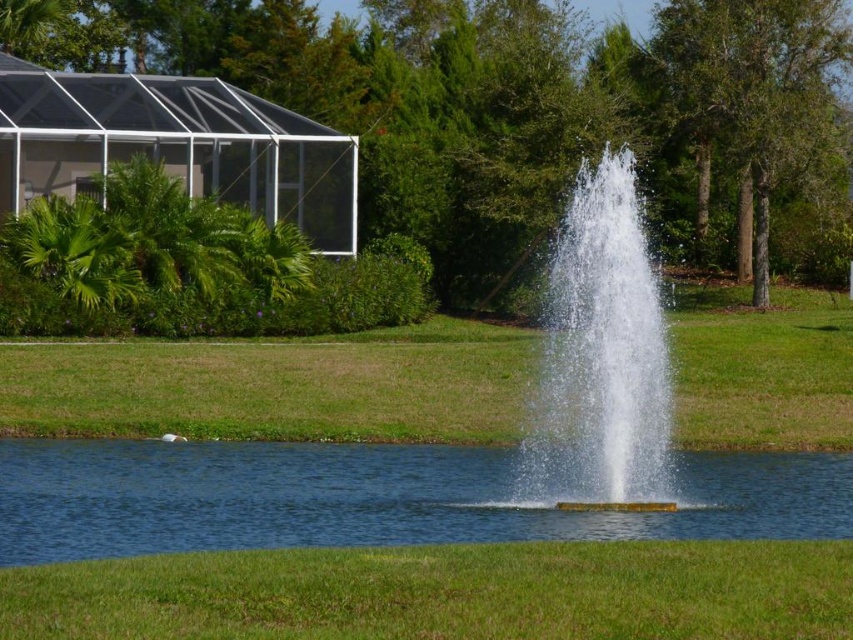
You are standing at the edge of the pond and want to reach the point marked at coordinates point (711, 524). If your walking speed is 3 feet per second, how many seconds will it take you to reach that point?

The distance between you and point (711, 524) is 66.42 feet. At a speed of 3 feet per second, it will take 22.14 seconds to reach the point.

You are standing at the edge of the pond and want to walk towards the fountain. There are two points marked on the ground, point (543, 513) and point (618, 476). Which point should you step on first to reach the fountain more quickly?

Point (543, 513) is closer to the camera than point (618, 476). Since you are at the edge of the pond, stepping on the closer point first would allow you to reach the fountain more quickly.

You are planning to place a small floating decoration in the image. The decoration requires a space wider than the clear water fountain at center to fit. Based on the scene, can you determine if the clear blue water at center has enough width to accommodate the decoration?

The clear blue water at center might be wider than the clear water fountain at center, so there is a possibility that the decoration can fit, but it is uncertain without exact measurements.